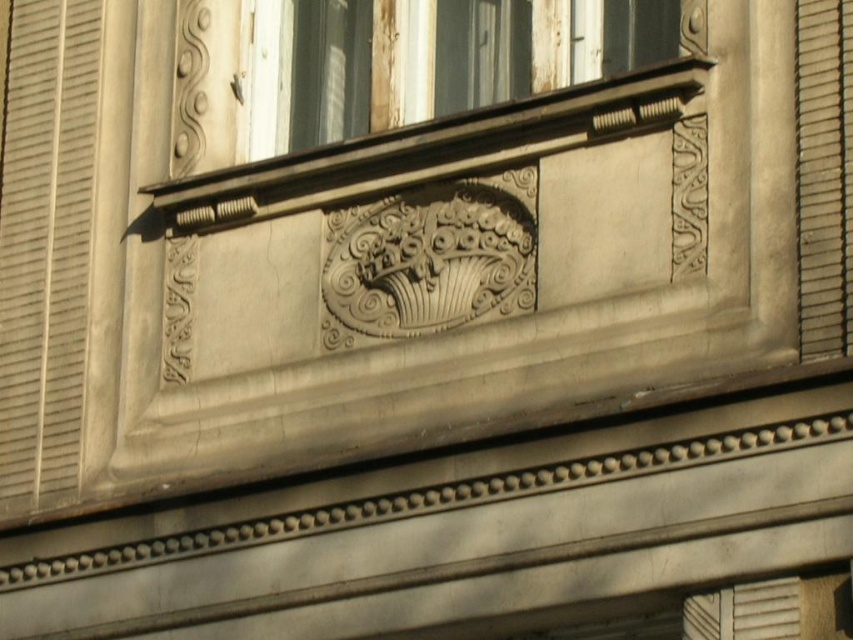
From the picture: You are an architect analyzing the facade details. You need to determine which object occupies a higher position in the vertical axis between the metallic silver shutter at left and the white stone window sill at upper center. Based on the scene, which one is higher?

The white stone window sill at upper center is positioned higher than the metallic silver shutter at left.